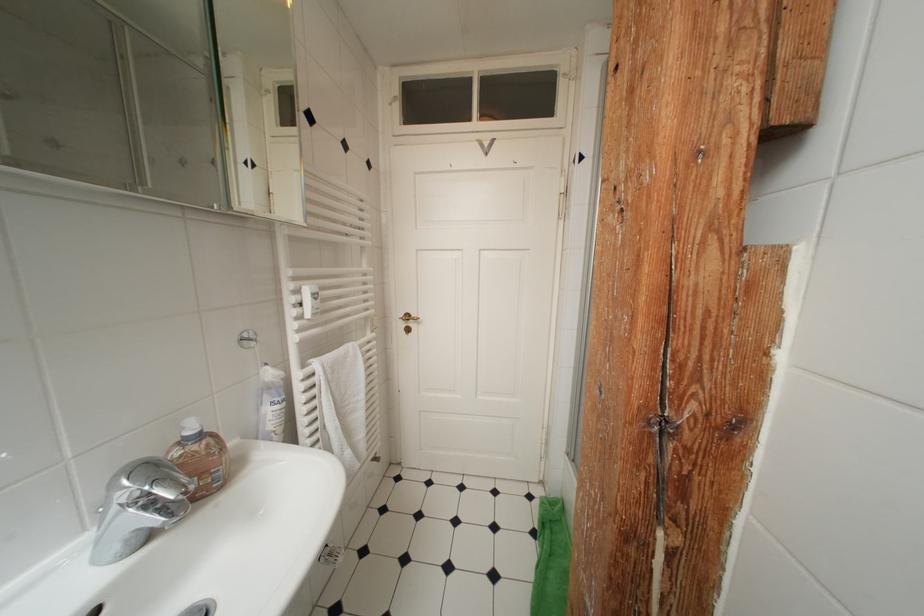
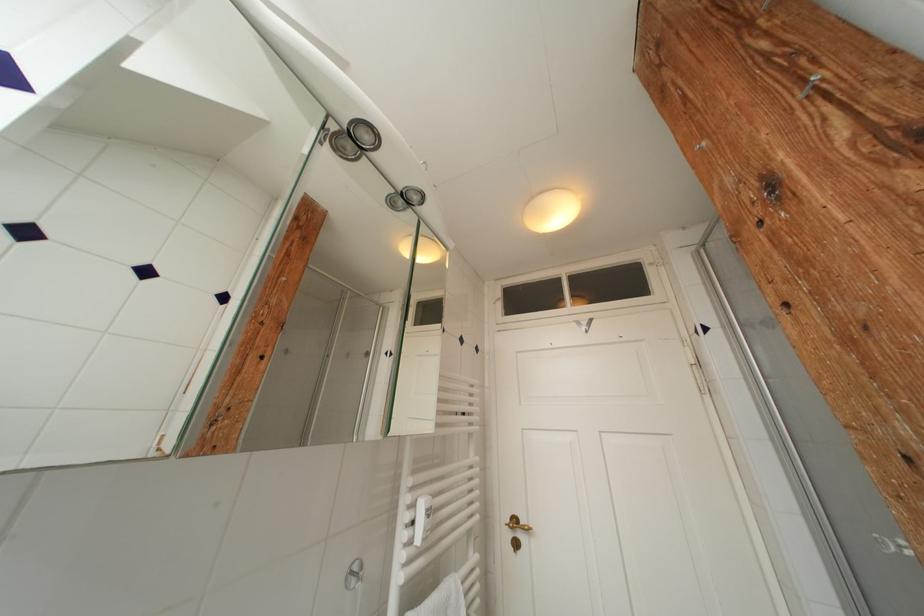
Locate, in the second image, the point that corresponds to [409,328] in the first image.

(516, 539)